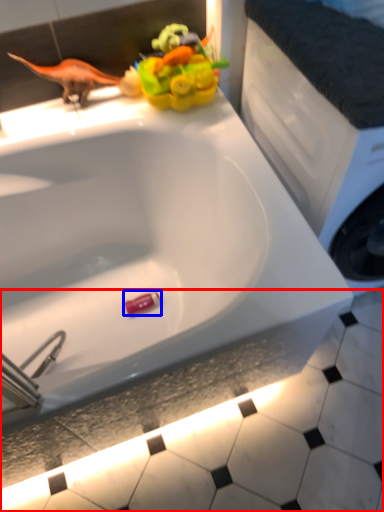
Question: Which object appears farthest to the camera in this image, tile (highlighted by a red box) or toy (highlighted by a blue box)?

Choices:
 (A) tile
 (B) toy

Answer: (B)